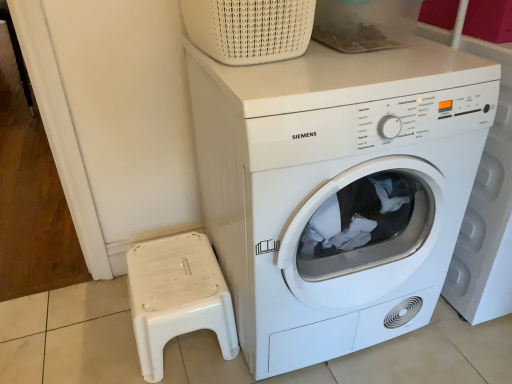
This screenshot has height=384, width=512. I want to click on empty space that is ontop of white plastic stool at lower left (from a real-world perspective), so click(x=169, y=273).